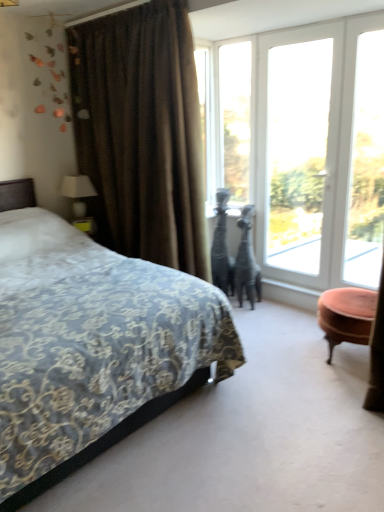
What is the approximate width of transparent glass window at upper center, which is counted as the fourth window, starting from the right?

transparent glass window at upper center, which is counted as the fourth window, starting from the right, is 4.87 inches in width.

Consider the image. What is the approximate width of white glass door at center, the second window positioned from the right?

The width of white glass door at center, the second window positioned from the right, is 7.95 centimeters.

Locate an element on the screen. This screenshot has height=512, width=384. white glass door at upper right, placed as the 1th window when sorted from right to left is located at coordinates 306,146.

Locate an element on the screen. clear glass window at center, the 3th window positioned from the right is located at coordinates (235, 118).

The width and height of the screenshot is (384, 512). What do you see at coordinates (91, 345) in the screenshot?
I see `velvet-patterned bed at left` at bounding box center [91, 345].

This screenshot has height=512, width=384. In order to click on transparent glass window at upper center, the first window when ordered from left to right in this screenshot , I will do `click(206, 121)`.

There is a velvet pink ottoman at right. Identify the location of window screen above it (from a real-world perspective). (366, 166).

Does point (348, 236) come farther from viewer compared to point (352, 330)?

Yes.

Between transparent glass window at upper right and velvet pink ottoman at right, which one has more height?

With more height is transparent glass window at upper right.

Would you consider transparent glass window at upper right to be distant from velvet pink ottoman at right?

transparent glass window at upper right is actually quite close to velvet pink ottoman at right.

Which object is closer to the camera, white fabric lampshade at left or velvet pink ottoman at right?

velvet pink ottoman at right is more forward.

Considering the sizes of objects white fabric lampshade at left and velvet pink ottoman at right in the image provided, who is smaller, white fabric lampshade at left or velvet pink ottoman at right?

With smaller size is white fabric lampshade at left.

Which of these two, white fabric lampshade at left or velvet pink ottoman at right, stands shorter?

With less height is white fabric lampshade at left.

Is white fabric lampshade at left not close to velvet pink ottoman at right?

Absolutely, white fabric lampshade at left is distant from velvet pink ottoman at right.

Locate an element on the screen. The height and width of the screenshot is (512, 384). table behind the velvet-patterned bed at left is located at coordinates (346, 315).

Considering the relative positions of velvet pink ottoman at right and velvet-patterned bed at left in the image provided, is velvet pink ottoman at right to the left of velvet-patterned bed at left from the viewer's perspective?

No, velvet pink ottoman at right is not to the left of velvet-patterned bed at left.

Based on the photo, is velvet pink ottoman at right far away from velvet-patterned bed at left?

Yes, velvet pink ottoman at right and velvet-patterned bed at left are located far from each other.

From a real-world perspective, which is physically below, transparent glass window at upper right or clear glass window at center, the 2th window positioned from the left?

In real-world perspective, transparent glass window at upper right is lower.

Considering their positions, is transparent glass window at upper right located in front of or behind clear glass window at center, the 2th window positioned from the left?

Clearly, transparent glass window at upper right is in front of clear glass window at center, the 2th window positioned from the left.

Is transparent glass window at upper right facing towards clear glass window at center, the 2th window positioned from the left?

No, transparent glass window at upper right is not aimed at clear glass window at center, the 2th window positioned from the left.

Do you think transparent glass window at upper right is within clear glass window at center, the 2th window positioned from the left, or outside of it?

transparent glass window at upper right is spatially situated outside clear glass window at center, the 2th window positioned from the left.

Which object is closer to the camera, white glass door at center, the second window positioned from the right, or white glass door at upper right, placed as the 1th window when sorted from right to left?

Positioned in front is white glass door at upper right, placed as the 1th window when sorted from right to left.

From the white glass door at upper right, the fourth window viewed from the left, count the 1st window to the left and point to it. Please provide its 2D coordinates.

[(297, 152)]

Who is smaller, white glass door at center, the second window positioned from the right, or white glass door at upper right, placed as the 1th window when sorted from right to left?

white glass door at upper right, placed as the 1th window when sorted from right to left, is smaller.

Is white glass door at center, placed as the 3th window when sorted from left to right, inside the boundaries of white glass door at upper right, placed as the 1th window when sorted from right to left, or outside?

white glass door at center, placed as the 3th window when sorted from left to right, fits inside white glass door at upper right, placed as the 1th window when sorted from right to left.

What's the angular difference between white glass door at center, placed as the 3th window when sorted from left to right, and white fabric lampshade at left's facing directions?

91.3 degrees.

Based on their positions, is white glass door at center, placed as the 3th window when sorted from left to right, located to the left or right of white fabric lampshade at left?

In the image, white glass door at center, placed as the 3th window when sorted from left to right, appears on the right side of white fabric lampshade at left.

Considering the positions of point (280, 128) and point (61, 187), is point (280, 128) closer or farther from the camera than point (61, 187)?

Point (280, 128).

How distant is transparent glass window at upper right from transparent glass window at upper center, which is counted as the fourth window, starting from the right?

1.28 meters.

Is transparent glass window at upper center, which is counted as the fourth window, starting from the right, completely or partially inside transparent glass window at upper right?

No, transparent glass window at upper right does not contain transparent glass window at upper center, which is counted as the fourth window, starting from the right.

Is transparent glass window at upper right oriented towards transparent glass window at upper center, the first window when ordered from left to right?

No, transparent glass window at upper right is not aimed at transparent glass window at upper center, the first window when ordered from left to right.

Which is more to the left, transparent glass window at upper right or transparent glass window at upper center, the first window when ordered from left to right?

Positioned to the left is transparent glass window at upper center, the first window when ordered from left to right.

This screenshot has height=512, width=384. Find the location of `window screen on the right of velvet pink ottoman at right`. window screen on the right of velvet pink ottoman at right is located at coordinates (366, 166).

Image resolution: width=384 pixels, height=512 pixels. Identify the location of table below the white fabric lampshade at left (from the image's perspective). (346, 315).

When comparing their distances from white glass door at upper right, the fourth window viewed from the left, does clear glass window at center, the 2th window positioned from the left, or transparent glass window at upper right seem further?

transparent glass window at upper right.

Estimate the real-world distances between objects in this image. Which object is further from velvet-patterned bed at left, transparent glass window at upper right or clear glass window at center, the 3th window positioned from the right?

transparent glass window at upper right is further to velvet-patterned bed at left.

From the picture: Estimate the real-world distances between objects in this image. Which object is further from velvet-patterned bed at left, white fabric lampshade at left or clear glass window at center, the 2th window positioned from the left?

clear glass window at center, the 2th window positioned from the left, lies further to velvet-patterned bed at left than the other object.

Estimate the real-world distances between objects in this image. Which object is further from clear glass window at center, the 2th window positioned from the left, velvet pink ottoman at right or brown velvet curtain at left?

Based on the image, velvet pink ottoman at right appears to be further to clear glass window at center, the 2th window positioned from the left.

Looking at this image, from the image, which object appears to be nearer to transparent glass window at upper right, transparent glass window at upper center, which is counted as the fourth window, starting from the right, or white fabric lampshade at left?

transparent glass window at upper center, which is counted as the fourth window, starting from the right, lies closer to transparent glass window at upper right than the other object.

Which object lies further to the anchor point velvet pink ottoman at right, white glass door at upper right, placed as the 1th window when sorted from right to left, or transparent glass window at upper right?

white glass door at upper right, placed as the 1th window when sorted from right to left, lies further to velvet pink ottoman at right than the other object.

From the image, which object appears to be farther from clear glass window at center, the 3th window positioned from the right, white fabric lampshade at left or velvet-patterned bed at left?

velvet-patterned bed at left.

From the image, which object appears to be nearer to brown velvet curtain at left, velvet-patterned bed at left or transparent glass window at upper right?

velvet-patterned bed at left.

Identify the location of curtain between velvet-patterned bed at left and white glass door at center, placed as the 3th window when sorted from left to right, in the horizontal direction. (142, 131).

Identify the location of window between transparent glass window at upper center, the first window when ordered from left to right, and white glass door at center, placed as the 3th window when sorted from left to right, from left to right. (235, 118).

This screenshot has height=512, width=384. Identify the location of table between velvet-patterned bed at left and clear glass window at center, the 3th window positioned from the right, in the front-back direction. (346, 315).

The image size is (384, 512). Find the location of `table situated between white fabric lampshade at left and transparent glass window at upper right from left to right`. table situated between white fabric lampshade at left and transparent glass window at upper right from left to right is located at coordinates (346, 315).